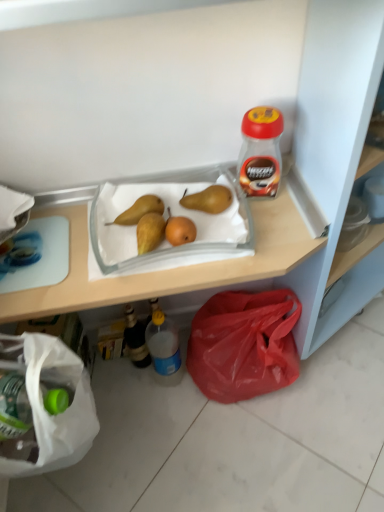
Question: Can you confirm if red plastic jar at upper right, which is the first bottle in top-to-bottom order, is shorter than translucent plastic bottle at lower center, marked as the third bottle in a top-to-bottom arrangement?

Choices:
 (A) yes
 (B) no

Answer: (A)

Question: Is red plastic jar at upper right, which is the third bottle in bottom-to-top order, at the left side of translucent plastic bottle at lower center, which ranks as the 1th bottle in bottom-to-top order?

Choices:
 (A) no
 (B) yes

Answer: (A)

Question: Is translucent plastic bottle at lower center, which ranks as the 1th bottle in bottom-to-top order, a part of red plastic jar at upper right, which is the third bottle in bottom-to-top order?

Choices:
 (A) yes
 (B) no

Answer: (B)

Question: Is red plastic jar at upper right, which is the third bottle in bottom-to-top order, smaller than translucent plastic bottle at lower center, the 2th bottle positioned from the right?

Choices:
 (A) no
 (B) yes

Answer: (B)

Question: Is red plastic jar at upper right, which is counted as the first bottle, starting from the right, beside translucent plastic bottle at lower center, which ranks as the 1th bottle in bottom-to-top order?

Choices:
 (A) yes
 (B) no

Answer: (B)

Question: From the image's perspective, is brown matte pear at center, positioned as the 1th pear in right-to-left order, positioned above or below yellow matte pear at center, arranged as the first pear when viewed from the left?

Choices:
 (A) below
 (B) above

Answer: (B)

Question: From a real-world perspective, is brown matte pear at center, positioned as the 1th pear in right-to-left order, physically located above or below yellow matte pear at center, arranged as the first pear when viewed from the left?

Choices:
 (A) above
 (B) below

Answer: (A)

Question: Is brown matte pear at center, arranged as the second pear when viewed from the left, taller or shorter than yellow matte pear at center, which ranks as the second pear in right-to-left order?

Choices:
 (A) short
 (B) tall

Answer: (A)

Question: Is point (223, 192) positioned closer to the camera than point (130, 223)?

Choices:
 (A) farther
 (B) closer

Answer: (A)

Question: Based on their positions, is translucent glass bottle at lower left, marked as the 3th bottle in a right-to-left arrangement, located to the left or right of red plastic jar at upper right, arranged as the 3th bottle when viewed from the left?

Choices:
 (A) right
 (B) left

Answer: (B)

Question: Considering the positions of translucent glass bottle at lower left, which is counted as the 1th bottle, starting from the left, and red plastic jar at upper right, which is the third bottle in bottom-to-top order, in the image, is translucent glass bottle at lower left, which is counted as the 1th bottle, starting from the left, taller or shorter than red plastic jar at upper right, which is the third bottle in bottom-to-top order,?

Choices:
 (A) short
 (B) tall

Answer: (B)

Question: Is translucent glass bottle at lower left, marked as the 3th bottle in a right-to-left arrangement, situated inside red plastic jar at upper right, which is the third bottle in bottom-to-top order, or outside?

Choices:
 (A) inside
 (B) outside

Answer: (B)

Question: Is translucent glass bottle at lower left, the 2th bottle viewed from the top, in front of or behind red plastic jar at upper right, which is the third bottle in bottom-to-top order, in the image?

Choices:
 (A) behind
 (B) front

Answer: (A)

Question: Considering the positions of red plastic bag at lower right and translucent glass bottle at lower left, which is counted as the 1th bottle, starting from the left, in the image, is red plastic bag at lower right taller or shorter than translucent glass bottle at lower left, which is counted as the 1th bottle, starting from the left,?

Choices:
 (A) tall
 (B) short

Answer: (A)

Question: Looking at their shapes, would you say red plastic bag at lower right is wider or thinner than translucent glass bottle at lower left, marked as the 3th bottle in a right-to-left arrangement?

Choices:
 (A) thin
 (B) wide

Answer: (B)